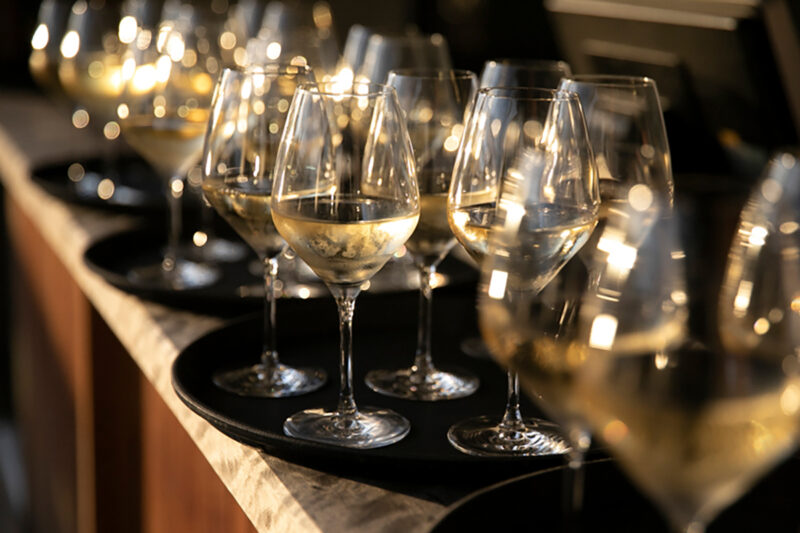
What are the coordinates of `trays` in the screenshot? It's located at (548, 513), (454, 482), (185, 294), (110, 197).